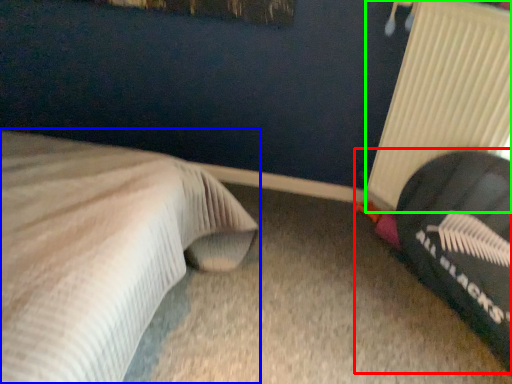
Question: Based on their relative distances, which object is nearer to bean bag chair (highlighted by a red box)? Choose from bed (highlighted by a blue box) and radiator (highlighted by a green box).

Choices:
 (A) bed
 (B) radiator

Answer: (B)